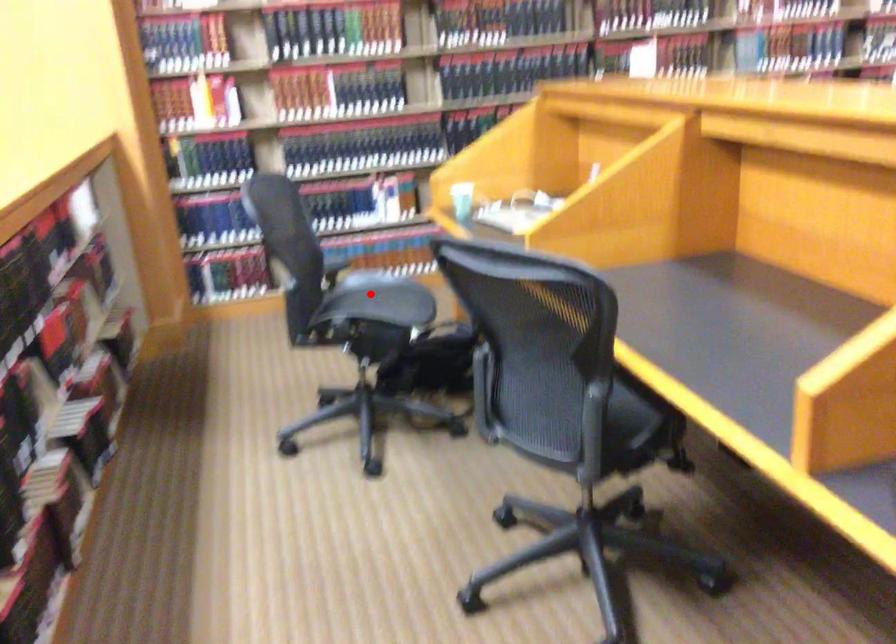
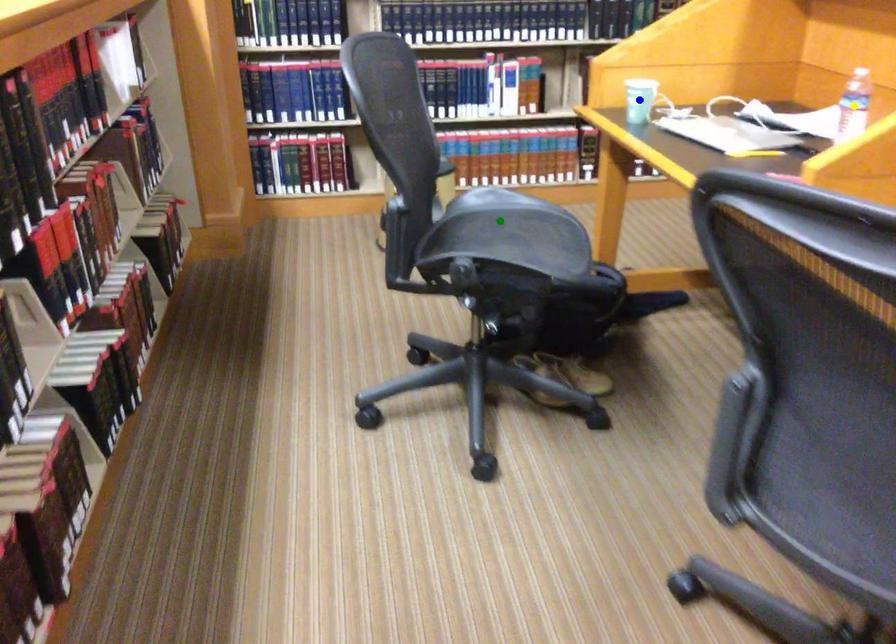
Question: I am providing you with two images of the same scene from different viewpoints. A red point is marked on the first image. You are given multiple points on the second image. Which point in image 2 represents the same 3d spot as the red point in image 1?

Choices:
 (A) blue point
 (B) green point
 (C) yellow point

Answer: (B)